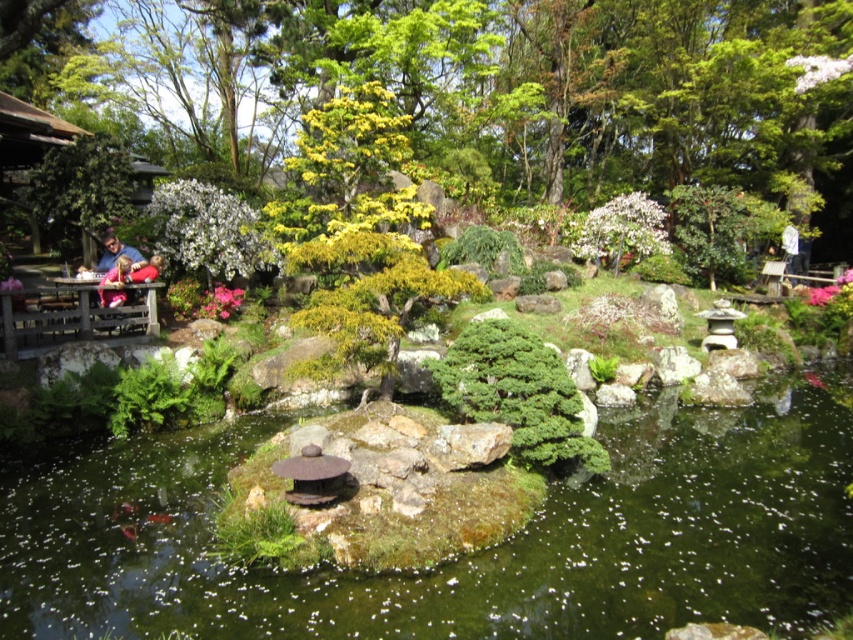
Can you confirm if green leafy tree at upper center is bigger than white matte flower at center?

Indeed, green leafy tree at upper center has a larger size compared to white matte flower at center.

Measure the distance from green leafy tree at upper center to white matte flower at center.

green leafy tree at upper center is 5.21 meters from white matte flower at center.

Between point (660, 42) and point (585, 225), which one is positioned behind?

Point (660, 42)

Locate an element on the screen. The height and width of the screenshot is (640, 853). green leafy tree at upper center is located at coordinates (525, 90).

Which is more to the left, yellow-green leafy plant at center or pink matte flower at upper right?

yellow-green leafy plant at center is more to the left.

Does yellow-green leafy plant at center appear on the right side of pink matte flower at upper right?

No, yellow-green leafy plant at center is not to the right of pink matte flower at upper right.

Where is `yellow-green leafy plant at center`? yellow-green leafy plant at center is located at coordinates [x=347, y=170].

Identify the location of yellow-green leafy plant at center. This screenshot has width=853, height=640. (347, 170).

Who is taller, white fluffy cloud at upper right or pink matte flower at upper right?

With more height is white fluffy cloud at upper right.

Is point (828, 67) positioned after point (844, 300)?

That is True.

Find the location of a particular element. white fluffy cloud at upper right is located at coordinates (817, 68).

In order to click on white fluffy cloud at upper right in this screenshot , I will do `click(817, 68)`.